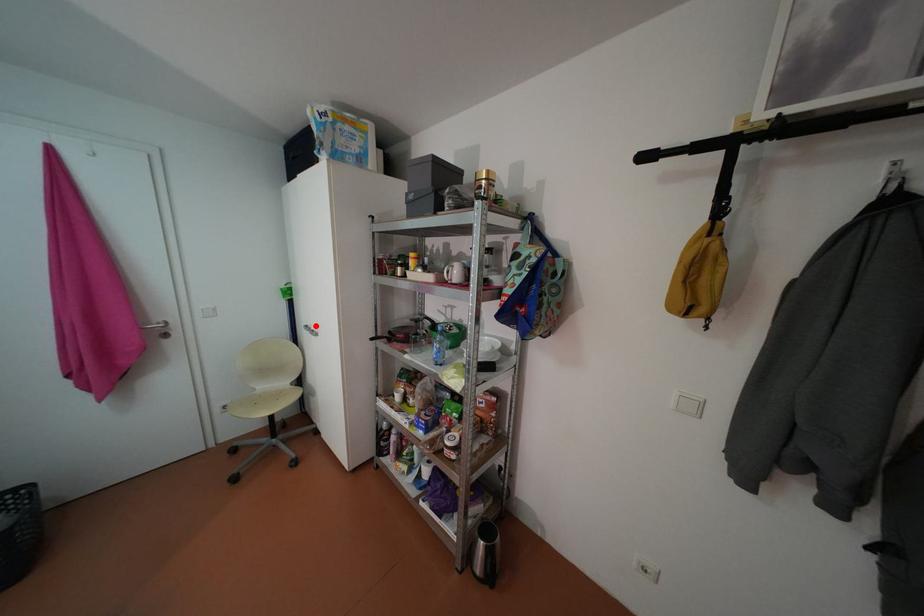
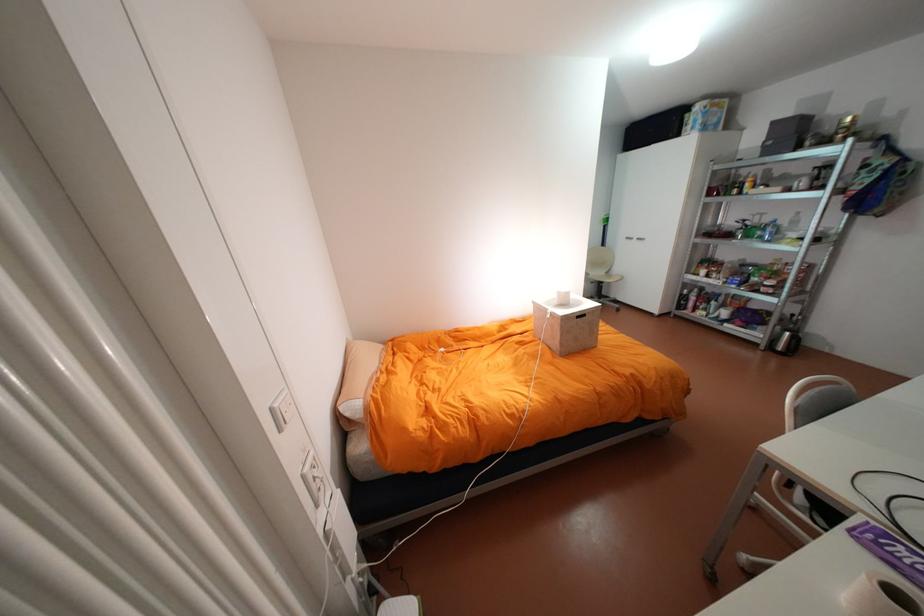
Find the pixel in the second image that matches the highlighted location in the first image.

(636, 237)